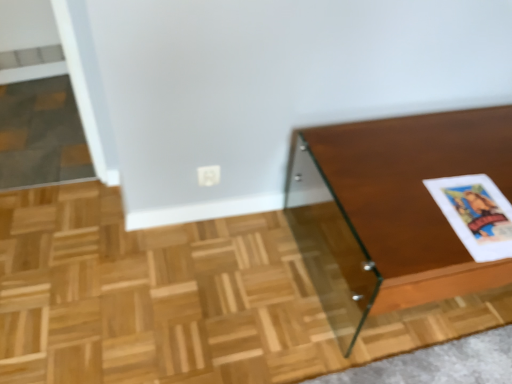
What do you see at coordinates (476, 214) in the screenshot?
I see `white paper at right` at bounding box center [476, 214].

This screenshot has height=384, width=512. Identify the location of white paper at right. (476, 214).

What do you see at coordinates (391, 211) in the screenshot? This screenshot has height=384, width=512. I see `wooden glossy table at right` at bounding box center [391, 211].

Locate an element on the screen. wooden glossy table at right is located at coordinates (391, 211).

I want to click on white paper at right, so click(476, 214).

Can you confirm if wooden glossy table at right is positioned to the left of white paper at right?

Incorrect, wooden glossy table at right is not on the left side of white paper at right.

Considering the relative positions of wooden glossy table at right and white paper at right in the image provided, is wooden glossy table at right in front of white paper at right?

Yes, wooden glossy table at right is closer to the camera.

Does point (362, 262) come closer to viewer compared to point (474, 180)?

Yes.

From the image's perspective, between wooden glossy table at right and white paper at right, which one is located above?

From the image's view, white paper at right is above.

From a real-world perspective, is wooden glossy table at right beneath white paper at right?

Yes, from a real-world perspective, wooden glossy table at right is under white paper at right.

Which object is wider, wooden glossy table at right or white paper at right?

wooden glossy table at right is wider.

Can you confirm if wooden glossy table at right is shorter than white paper at right?

Incorrect, the height of wooden glossy table at right does not fall short of that of white paper at right.

Considering the sizes of objects wooden glossy table at right and white paper at right in the image provided, who is smaller, wooden glossy table at right or white paper at right?

With smaller size is white paper at right.

Consider the image. Is wooden glossy table at right spatially inside white paper at right, or outside of it?

wooden glossy table at right is located beyond the bounds of white paper at right.

Consider the image. Is there a large distance between wooden glossy table at right and white paper at right?

That's not correct — wooden glossy table at right is a little close to white paper at right.

Is wooden glossy table at right turned away from white paper at right?

No, wooden glossy table at right is not facing away from white paper at right.

How different are the orientations of wooden glossy table at right and white paper at right in degrees?

The facing directions of wooden glossy table at right and white paper at right are 2.56 degrees apart.

You are a GUI agent. You are given a task and a screenshot of the screen. Output one action in this format:
    pyautogui.click(x=<x>, y=<y>)
    Task: Click on the table below the white paper at right (from the image's perspective)
    
    Given the screenshot: What is the action you would take?
    pyautogui.click(x=391, y=211)

Visually, is white paper at right positioned to the left or to the right of wooden glossy table at right?

From the image, it's evident that white paper at right is to the left of wooden glossy table at right.

Who is more distant, white paper at right or wooden glossy table at right?

white paper at right is behind.

Considering the positions of points (466, 231) and (305, 264), is point (466, 231) closer to camera compared to point (305, 264)?

Yes.

From the image's perspective, is white paper at right above wooden glossy table at right?

Yes, from the image's perspective, white paper at right is over wooden glossy table at right.

From a real-world perspective, who is located higher, white paper at right or wooden glossy table at right?

white paper at right is physically above.

Which object is wider, white paper at right or wooden glossy table at right?

wooden glossy table at right.

Does white paper at right have a lesser height compared to wooden glossy table at right?

Yes, white paper at right is shorter than wooden glossy table at right.

In terms of size, does white paper at right appear bigger or smaller than wooden glossy table at right?

In the image, white paper at right appears to be smaller than wooden glossy table at right.

Based on the photo, would you say wooden glossy table at right is part of white paper at right's contents?

No.

Is white paper at right beside wooden glossy table at right?

white paper at right and wooden glossy table at right are not in contact.

Is white paper at right oriented towards wooden glossy table at right?

Yes.

What's the angular difference between white paper at right and wooden glossy table at right's facing directions?

They differ by 2.56 degrees in their facing directions.

How much distance is there between white paper at right and wooden glossy table at right?

A distance of 7.87 inches exists between white paper at right and wooden glossy table at right.

I want to click on magazine that appears above the wooden glossy table at right (from the image's perspective), so click(x=476, y=214).

Locate an element on the screen. This screenshot has width=512, height=384. magazine above the wooden glossy table at right (from the image's perspective) is located at coordinates (476, 214).

The height and width of the screenshot is (384, 512). Identify the location of magazine above the wooden glossy table at right (from a real-world perspective). (476, 214).